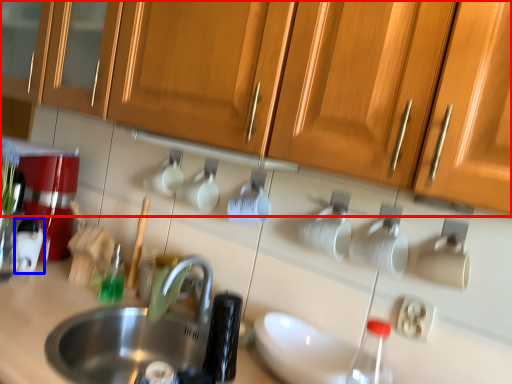
Question: Which of the following is the closest to the observer, cabinetry (highlighted by a red box) or appliance (highlighted by a blue box)?

Choices:
 (A) cabinetry
 (B) appliance

Answer: (A)